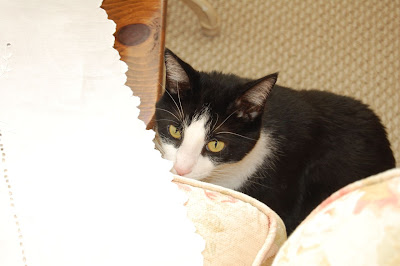
Where is `the back table leg`? the back table leg is located at coordinates (199, 6).